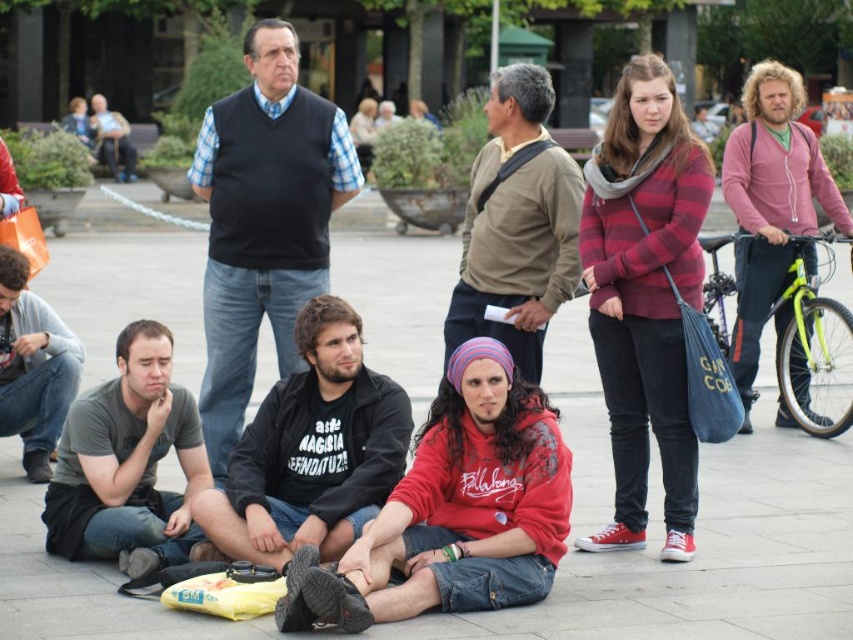
Is point (374, 577) positioned before point (262, 266)?

Yes, it is in front of point (262, 266).

From the picture: Does red fleece at center come in front of dark blue sweater at center?

Yes, it is in front of dark blue sweater at center.

Identify the location of red fleece at center. (456, 509).

Who is positioned more to the left, red fleece at center or fluffy pink sweater at right?

red fleece at center

This screenshot has width=853, height=640. What do you see at coordinates (456, 509) in the screenshot? I see `red fleece at center` at bounding box center [456, 509].

Describe the element at coordinates (456, 509) in the screenshot. The height and width of the screenshot is (640, 853). I see `red fleece at center` at that location.

I want to click on red fleece at center, so click(456, 509).

Is matte concrete pavement at center shorter than fluffy pink sweater at right?

Yes, matte concrete pavement at center is shorter than fluffy pink sweater at right.

Does matte concrete pavement at center have a smaller size compared to fluffy pink sweater at right?

Correct, matte concrete pavement at center occupies less space than fluffy pink sweater at right.

Is point (795, 605) farther from camera compared to point (764, 296)?

That is False.

Locate an element on the screen. This screenshot has height=640, width=853. matte concrete pavement at center is located at coordinates (695, 531).